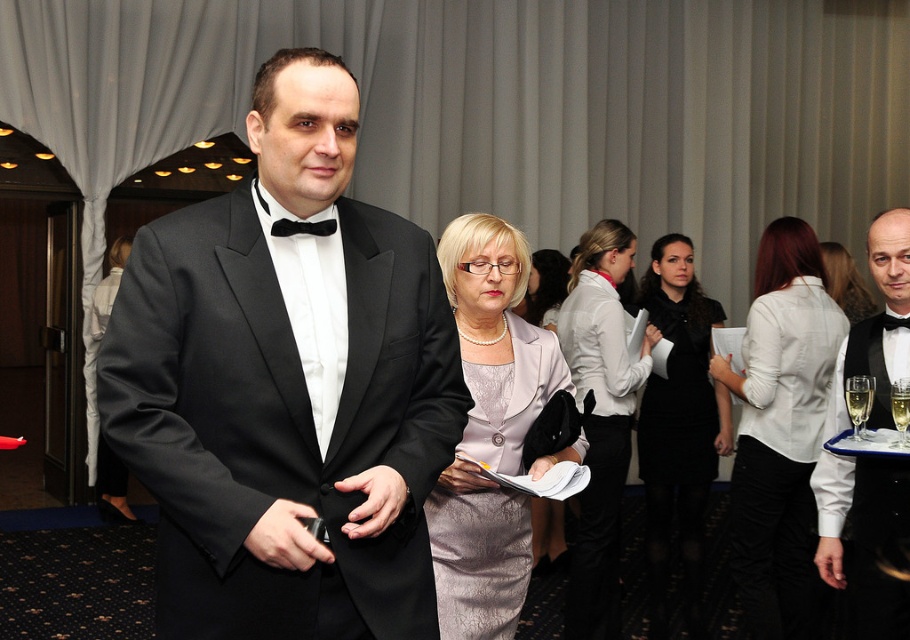
Looking at this image, you are attending a formal event and notice two attendees wearing the white satin blouse at center and the satin gray dress at center. Which one has a wider silhouette according to the description?

The white satin blouse at center might be wider than the satin gray dress at center.